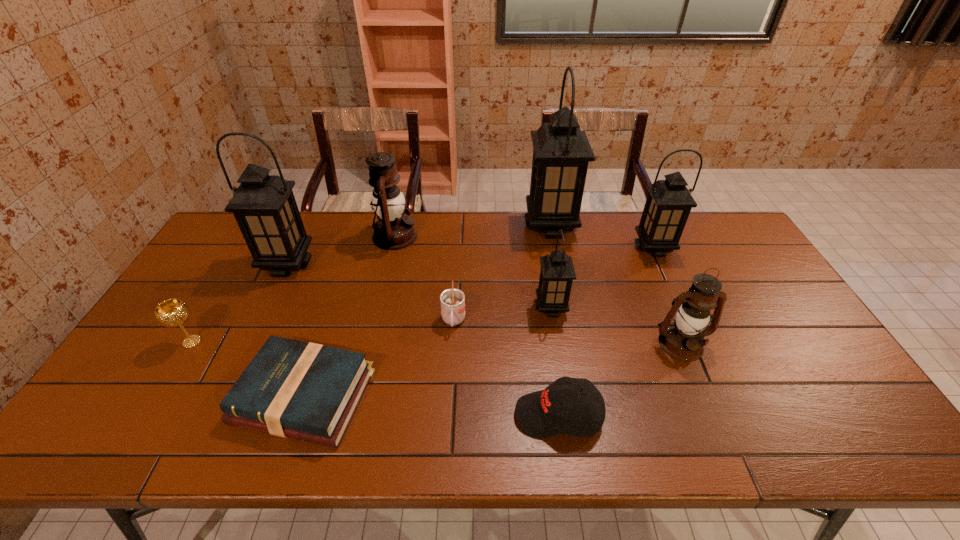
Where is `vacant area that lies between the second lantern from left to right and the leftmost black lantern`? The height and width of the screenshot is (540, 960). vacant area that lies between the second lantern from left to right and the leftmost black lantern is located at coordinates (342, 250).

Locate an element on the screen. The width and height of the screenshot is (960, 540). free space between the blue hardback book and the rightmost black lantern is located at coordinates (479, 322).

At what (x,y) coordinates should I click in order to perform the action: click on free space between the black baseball cap and the rightmost black lantern. Please return your answer as a coordinate pair (x, y). The width and height of the screenshot is (960, 540). Looking at the image, I should click on (606, 332).

Locate an element on the screen. This screenshot has width=960, height=540. free space between the smaller brown lantern and the tallest object is located at coordinates (615, 285).

Identify the location of free space between the baseball cap and the leftmost black lantern. coord(423,340).

Locate an element on the screen. The height and width of the screenshot is (540, 960). free space that is in between the second smallest black lantern and the fifth farthest lantern is located at coordinates (603, 278).

Identify which object is the eighth nearest to the third smallest black lantern. Please provide its 2D coordinates. Your answer should be formatted as a tuple, i.e. [(x, y)], where the tuple contains the x and y coordinates of a point satisfying the conditions above.

[(683, 339)]

Point out which object is positioned as the eighth nearest to the cup. Please provide its 2D coordinates. Your answer should be formatted as a tuple, i.e. [(x, y)], where the tuple contains the x and y coordinates of a point satisfying the conditions above.

[(669, 202)]

Locate which lantern is the fourth closest to the farther brown lantern. Please provide its 2D coordinates. Your answer should be formatted as a tuple, i.e. [(x, y)], where the tuple contains the x and y coordinates of a point satisfying the conditions above.

[(669, 202)]

Find the location of a particular element. The image size is (960, 540). the second closest lantern to the fifth farthest lantern is located at coordinates (561, 151).